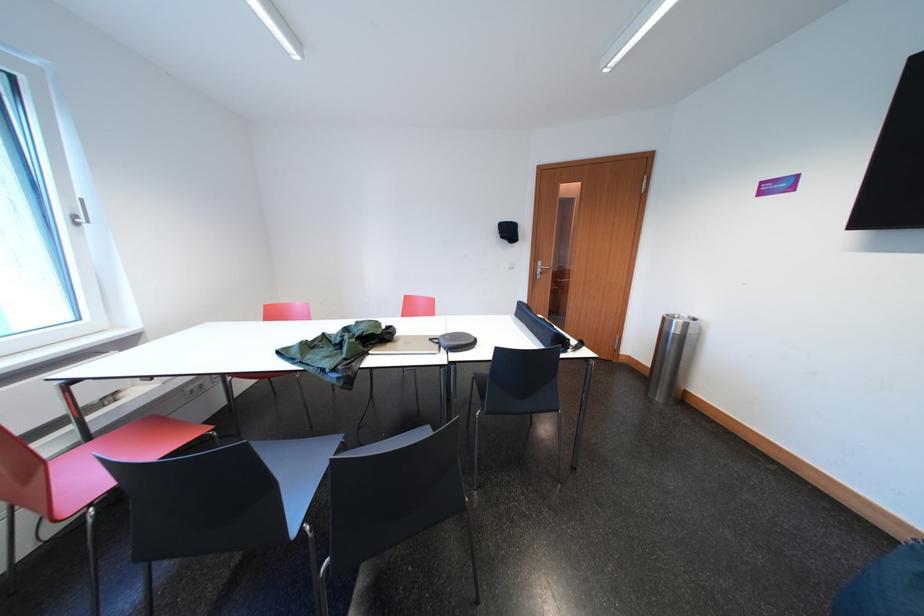
Which object does [337,351] point to?

It corresponds to the long black bag in the image.